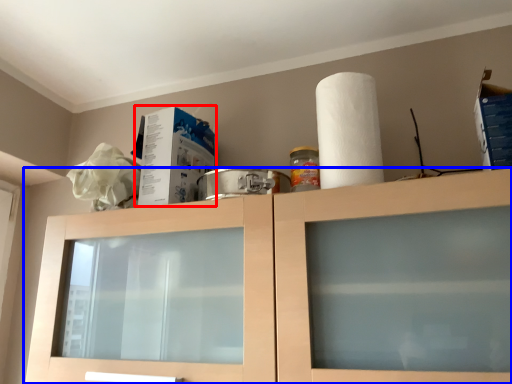
Question: Which object appears closest to the camera in this image, box (highlighted by a red box) or cabinetry (highlighted by a blue box)?

Choices:
 (A) box
 (B) cabinetry

Answer: (B)